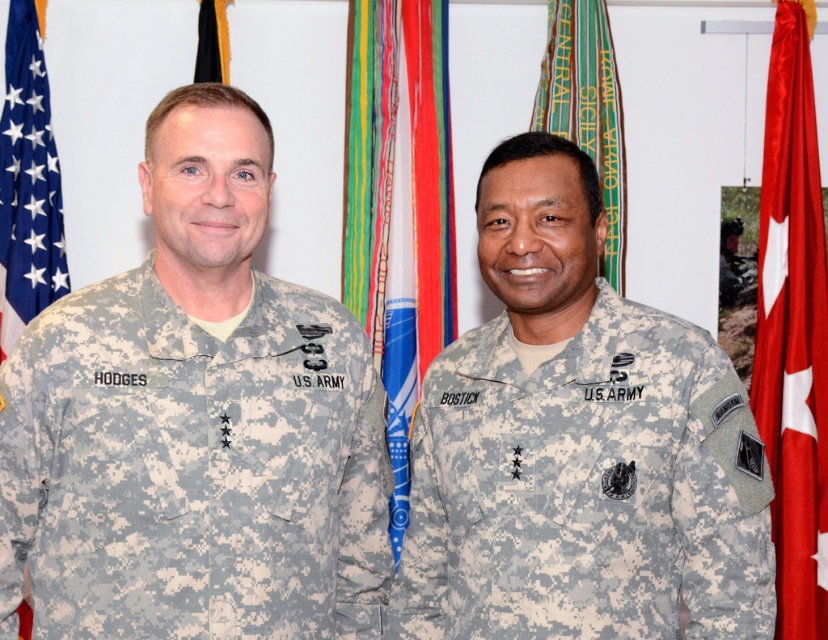
You are a photographer taking a picture of the scene. You need to adjust your camera to focus on both the camouflage fabric uniform at right and the blue fabric flag at center. Which one should you focus on first to ensure both are in focus?

You should focus on the camouflage fabric uniform at right first because it is closer to the viewer than the blue fabric flag at center, so adjusting focus starting from the closer object ensures both will be in focus.

You are a photographer adjusting the camera to capture the two soldiers and the flags. The blue fabric flag at center and the black fabric flag at upper center are both in the frame. Which flag should you focus on to ensure it fills more of the camera view?

The blue fabric flag at center should be focused on because its width is larger than the black fabric flag at upper center, making it a better candidate to fill more of the camera view.

From the picture: You are a photographer who needs to capture a photo of the blue fabric flag at center and the black fabric flag at upper center. Based on their positions, which flag should you focus on first to ensure both are in frame?

The blue fabric flag at center is below the black fabric flag at upper center, so you should focus on the black fabric flag at upper center first to ensure both are in frame.